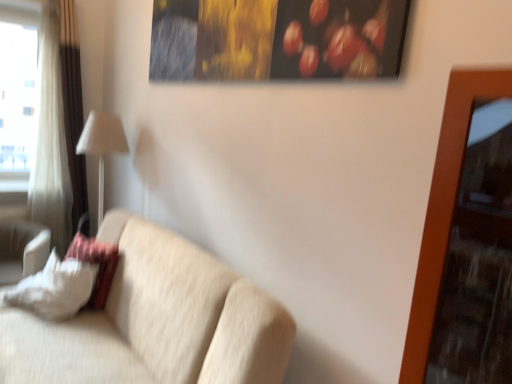
Question: Is beige fabric couch at center next to white soft pillow at lower left, which is the first pillow in left-to-right order?

Choices:
 (A) yes
 (B) no

Answer: (B)

Question: Is the position of beige fabric couch at center less distant than that of white soft pillow at lower left, the 2th pillow viewed from the right?

Choices:
 (A) no
 (B) yes

Answer: (B)

Question: From the image's perspective, is beige fabric couch at center on white soft pillow at lower left, the 2th pillow viewed from the right?

Choices:
 (A) yes
 (B) no

Answer: (B)

Question: From a real-world perspective, is beige fabric couch at center positioned under white soft pillow at lower left, which is the first pillow in left-to-right order, based on gravity?

Choices:
 (A) yes
 (B) no

Answer: (B)

Question: Is beige fabric couch at center turned away from white soft pillow at lower left, the 2th pillow viewed from the right?

Choices:
 (A) no
 (B) yes

Answer: (A)

Question: Is beige fabric couch at center surrounding white soft pillow at lower left, the 2th pillow viewed from the right?

Choices:
 (A) no
 (B) yes

Answer: (A)

Question: Can you confirm if white fabric pillow at left, the 1th pillow from the right, is smaller than beige fabric couch at center?

Choices:
 (A) no
 (B) yes

Answer: (B)

Question: From a real-world perspective, is white fabric pillow at left, the 1th pillow from the right, over beige fabric couch at center?

Choices:
 (A) yes
 (B) no

Answer: (A)

Question: Is the position of white fabric pillow at left, the 2th pillow in the left-to-right sequence, less distant than that of beige fabric couch at center?

Choices:
 (A) yes
 (B) no

Answer: (B)

Question: Is white fabric pillow at left, the 2th pillow in the left-to-right sequence, aimed at beige fabric couch at center?

Choices:
 (A) yes
 (B) no

Answer: (A)

Question: Considering the relative sizes of white fabric pillow at left, the 2th pillow in the left-to-right sequence, and beige fabric couch at center in the image provided, is white fabric pillow at left, the 2th pillow in the left-to-right sequence, wider than beige fabric couch at center?

Choices:
 (A) no
 (B) yes

Answer: (A)

Question: From the image's perspective, is white fabric pillow at left, the 1th pillow from the right, over beige fabric couch at center?

Choices:
 (A) no
 (B) yes

Answer: (B)

Question: From a real-world perspective, is white soft pillow at lower left, the 2th pillow viewed from the right, on top of beige fabric couch at center?

Choices:
 (A) yes
 (B) no

Answer: (B)